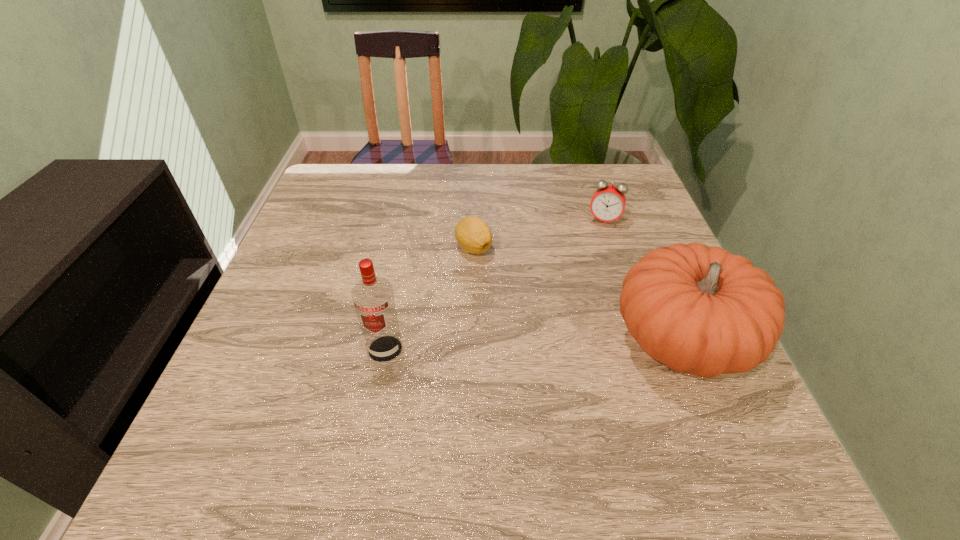
The height and width of the screenshot is (540, 960). Identify the location of vacant spot on the desktop that is between the tallest object and the pumpkin and is positioned at the stem end of the lemon. (497, 346).

Locate an element on the screen. free space on the desktop that is between the vodka and the pumpkin and is positioned on the front-facing side of the farthest object is located at coordinates (575, 344).